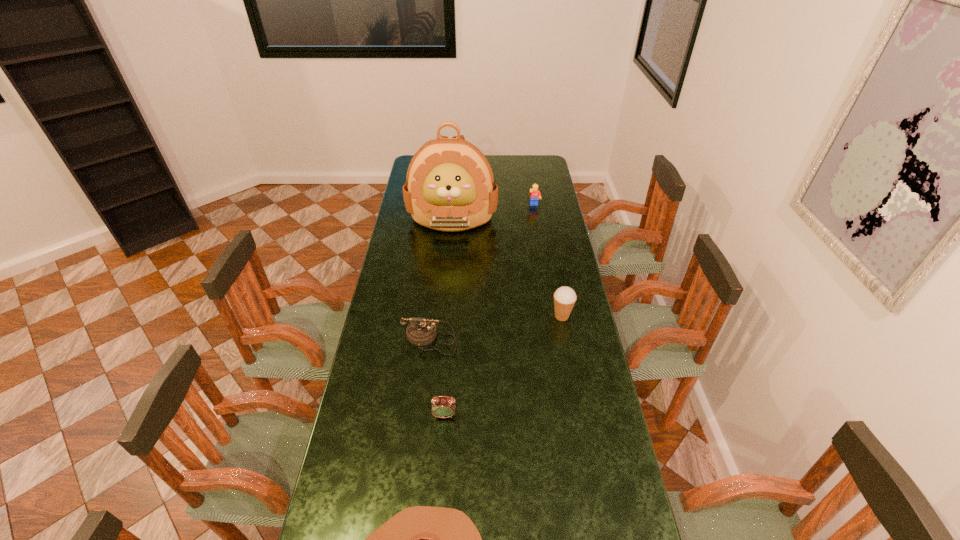
Image resolution: width=960 pixels, height=540 pixels. In order to click on free spot between the second tallest object and the alarm clock in this screenshot , I will do `click(503, 366)`.

You are a GUI agent. You are given a task and a screenshot of the screen. Output one action in this format:
    pyautogui.click(x=<x>, y=<y>)
    Task: Click on the empty space between the icecream and the tallest object
    The width and height of the screenshot is (960, 540).
    Given the screenshot: What is the action you would take?
    pyautogui.click(x=507, y=267)

Identify the location of unoccupied area between the Lego and the telephone. The width and height of the screenshot is (960, 540). (482, 273).

At what (x,y) coordinates should I click in order to perform the action: click on free space between the icecream and the second nearest object. Please return your answer as a coordinate pair (x, y). The width and height of the screenshot is (960, 540). Looking at the image, I should click on (503, 366).

Where is `object that ranks as the fifth closest to the cowboy hat`? The height and width of the screenshot is (540, 960). object that ranks as the fifth closest to the cowboy hat is located at coordinates (535, 194).

Identify which object is the third nearest to the telephone. Please provide its 2D coordinates. Your answer should be formatted as a tuple, i.e. [(x, y)], where the tuple contains the x and y coordinates of a point satisfying the conditions above.

[(422, 539)]

Locate an element on the screen. The image size is (960, 540). free space that satisfies the following two spatial constraints: 1. on the front-facing side of the backpack; 2. on the right side of the icecream is located at coordinates (444, 316).